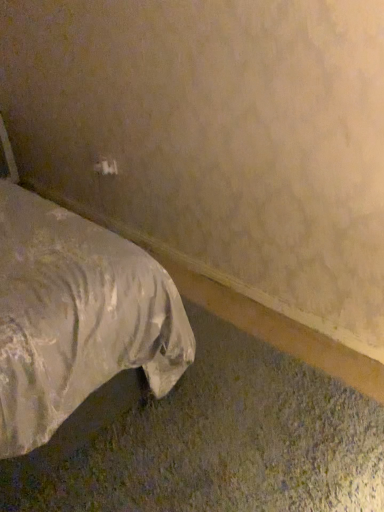
Consider the image. What is the approximate width of white plastic electric outlet at upper center?

white plastic electric outlet at upper center is 2.23 centimeters in width.

You are a GUI agent. You are given a task and a screenshot of the screen. Output one action in this format:
    pyautogui.click(x=<x>, y=<y>)
    Task: Click on the white plastic electric outlet at upper center
    The image size is (384, 512).
    Given the screenshot: What is the action you would take?
    pyautogui.click(x=106, y=167)

The image size is (384, 512). What do you see at coordinates (106, 167) in the screenshot? I see `white plastic electric outlet at upper center` at bounding box center [106, 167].

The height and width of the screenshot is (512, 384). What do you see at coordinates (75, 314) in the screenshot?
I see `white satin bed at lower left` at bounding box center [75, 314].

The image size is (384, 512). What are the coordinates of `white satin bed at lower left` in the screenshot? It's located at (75, 314).

Where is `white plastic electric outlet at upper center`? Image resolution: width=384 pixels, height=512 pixels. white plastic electric outlet at upper center is located at coordinates (106, 167).

Considering the relative positions of white plastic electric outlet at upper center and white satin bed at lower left in the image provided, is white plastic electric outlet at upper center to the left or to the right of white satin bed at lower left?

white plastic electric outlet at upper center is positioned on white satin bed at lower left's right side.

Is white plastic electric outlet at upper center behind white satin bed at lower left?

Yes, it is.

Is point (104, 158) closer to camera compared to point (21, 210)?

No, (104, 158) is further to viewer.

From the image's perspective, which is above, white plastic electric outlet at upper center or white satin bed at lower left?

white plastic electric outlet at upper center appears higher in the image.

From a real-world perspective, which object rests below the other?

white plastic electric outlet at upper center, from a real-world perspective.

In terms of width, does white plastic electric outlet at upper center look wider or thinner when compared to white satin bed at lower left?

Clearly, white plastic electric outlet at upper center has less width compared to white satin bed at lower left.

Can you confirm if white plastic electric outlet at upper center is shorter than white satin bed at lower left?

Yes.

Considering the relative sizes of white plastic electric outlet at upper center and white satin bed at lower left in the image provided, is white plastic electric outlet at upper center smaller than white satin bed at lower left?

Indeed, white plastic electric outlet at upper center has a smaller size compared to white satin bed at lower left.

Is white plastic electric outlet at upper center outside of white satin bed at lower left?

Yes.

Are white plastic electric outlet at upper center and white satin bed at lower left far apart?

Absolutely, white plastic electric outlet at upper center is distant from white satin bed at lower left.

Could you tell me if white plastic electric outlet at upper center is turned towards white satin bed at lower left?

Yes, white plastic electric outlet at upper center is facing white satin bed at lower left.

This screenshot has height=512, width=384. What are the coordinates of `electric outlet on the right of the white satin bed at lower left` in the screenshot? It's located at (106, 167).

Considering the relative positions of white satin bed at lower left and white plastic electric outlet at upper center in the image provided, is white satin bed at lower left to the left or to the right of white plastic electric outlet at upper center?

Based on their positions, white satin bed at lower left is located to the left of white plastic electric outlet at upper center.

Considering the positions of objects white satin bed at lower left and white plastic electric outlet at upper center in the image provided, who is behind, white satin bed at lower left or white plastic electric outlet at upper center?

white plastic electric outlet at upper center is further from the camera.

Does point (173, 357) appear closer or farther from the camera than point (109, 168)?

Point (173, 357) appears to be closer to the viewer than point (109, 168).

From the image's perspective, between white satin bed at lower left and white plastic electric outlet at upper center, who is located below?

white satin bed at lower left appears lower in the image.

Based on the photo, from a real-world perspective, does white satin bed at lower left sit lower than white plastic electric outlet at upper center?

No.

Does white satin bed at lower left have a lesser width compared to white plastic electric outlet at upper center?

No.

Between white satin bed at lower left and white plastic electric outlet at upper center, which one has more height?

white satin bed at lower left.

Is white satin bed at lower left smaller than white plastic electric outlet at upper center?

No.

Is white plastic electric outlet at upper center completely or partially inside white satin bed at lower left?

No.

Would you say white satin bed at lower left is a long distance from white plastic electric outlet at upper center?

white satin bed at lower left is positioned a significant distance from white plastic electric outlet at upper center.

Is white satin bed at lower left aimed at white plastic electric outlet at upper center?

No.

How different are the orientations of white satin bed at lower left and white plastic electric outlet at upper center in degrees?

white satin bed at lower left and white plastic electric outlet at upper center are facing 87.9 degrees away from each other.

In the scene shown: How much distance is there between white satin bed at lower left and white plastic electric outlet at upper center?

3.95 feet.

Find the location of a particular element. The image size is (384, 512). bed lying in front of the white plastic electric outlet at upper center is located at coordinates (75, 314).

Identify the location of bed above the white plastic electric outlet at upper center (from a real-world perspective). The width and height of the screenshot is (384, 512). (75, 314).

The height and width of the screenshot is (512, 384). In the image, there is a white satin bed at lower left. Identify the location of electric outlet below it (from a real-world perspective). (106, 167).